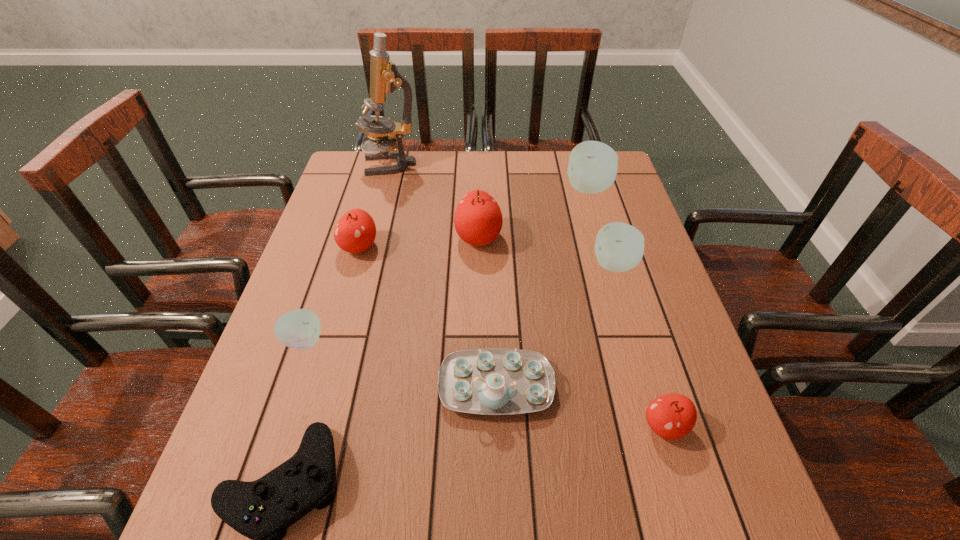
You are a GUI agent. You are given a task and a screenshot of the screen. Output one action in this format:
    pyautogui.click(x=<x>, y=<y>)
    Task: Click on the second closest apple to the chinaware
    
    Given the screenshot: What is the action you would take?
    pyautogui.click(x=619, y=247)

The image size is (960, 540). I want to click on apple that can be found as the fifth closest to the second biggest white apple, so click(x=299, y=329).

Identify which white apple is the third nearest to the chinaware. Please provide its 2D coordinates. Your answer should be formatted as a tuple, i.e. [(x, y)], where the tuple contains the x and y coordinates of a point satisfying the conditions above.

[(592, 168)]

I want to click on white apple that stands as the third closest to the control, so click(592, 168).

Where is `red apple that is the third closest to the shortest object`? This screenshot has height=540, width=960. red apple that is the third closest to the shortest object is located at coordinates (672, 416).

At what (x,y) coordinates should I click in order to perform the action: click on red apple that is the closest to the leftmost white apple. Please return your answer as a coordinate pair (x, y). This screenshot has width=960, height=540. Looking at the image, I should click on (355, 232).

The width and height of the screenshot is (960, 540). What are the coordinates of `vacant position in the image that satisfies the following two spatial constraints: 1. on the front side of the biggest white apple; 2. on the left side of the tallest object` in the screenshot? It's located at (385, 188).